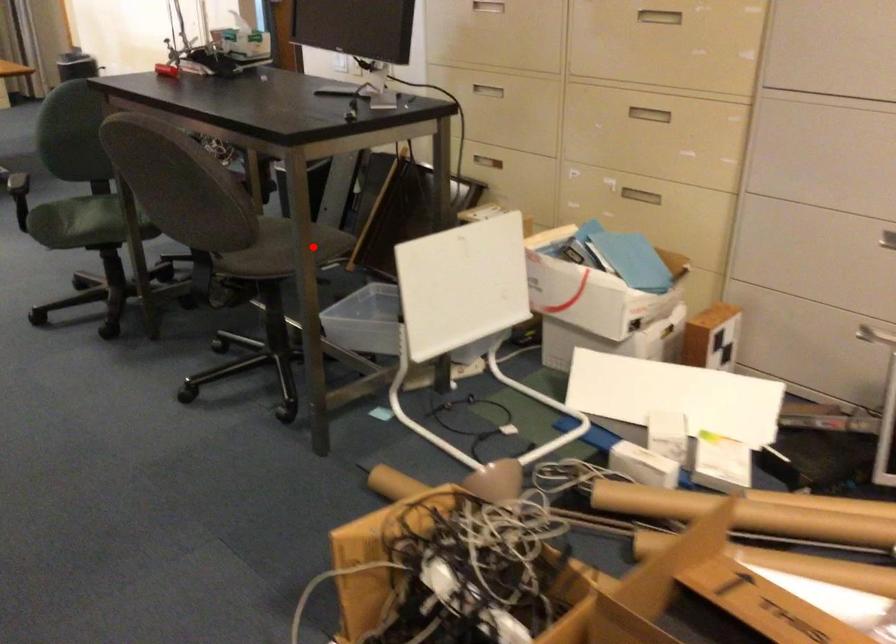
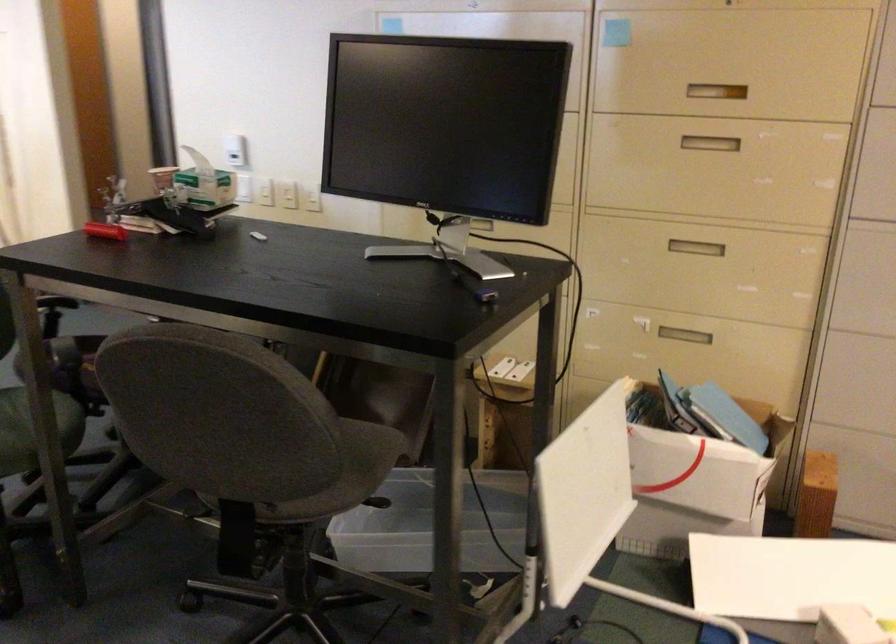
The point at the highlighted location is marked in the first image. Where is the corresponding point in the second image?

(364, 462)